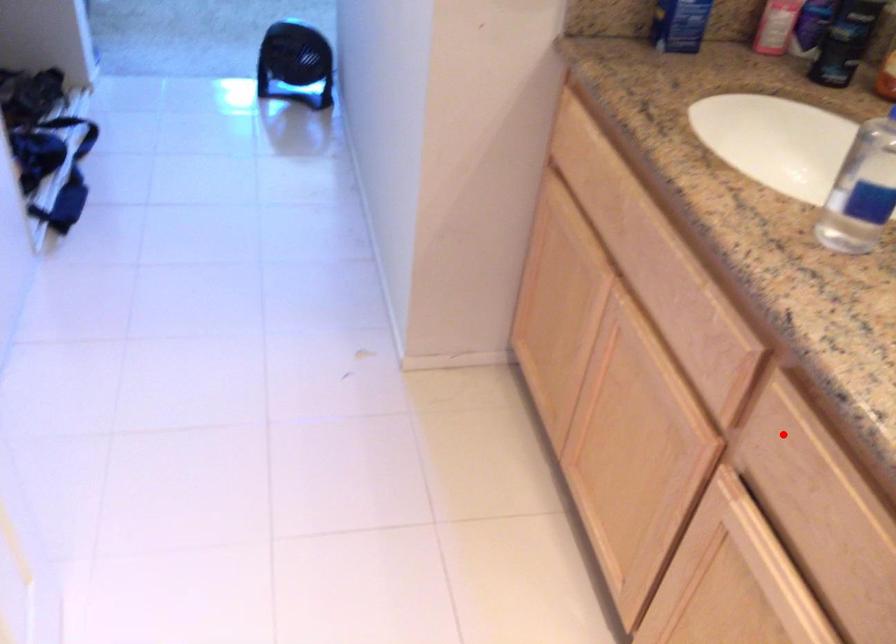
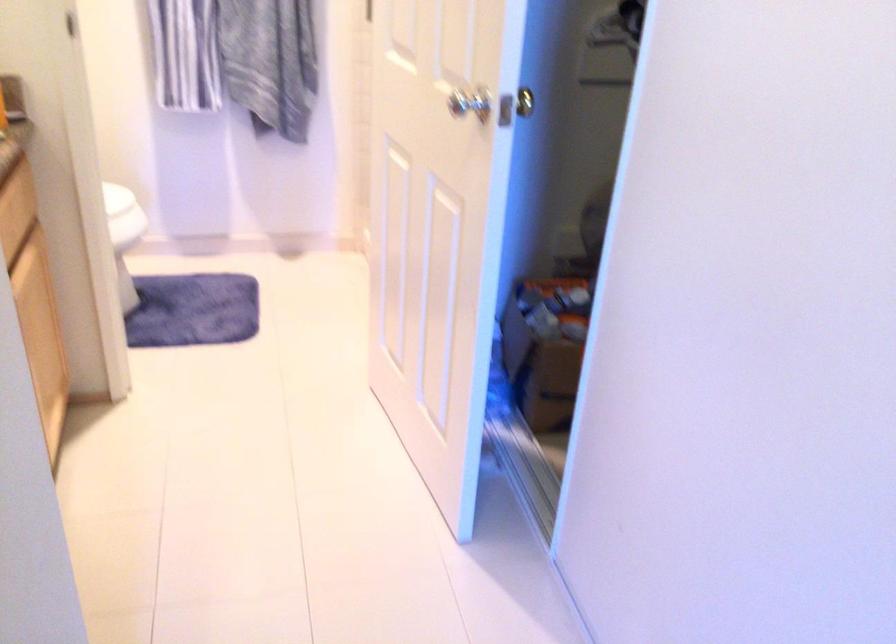
Find the pixel in the second image that matches the highlighted location in the first image.

(12, 229)